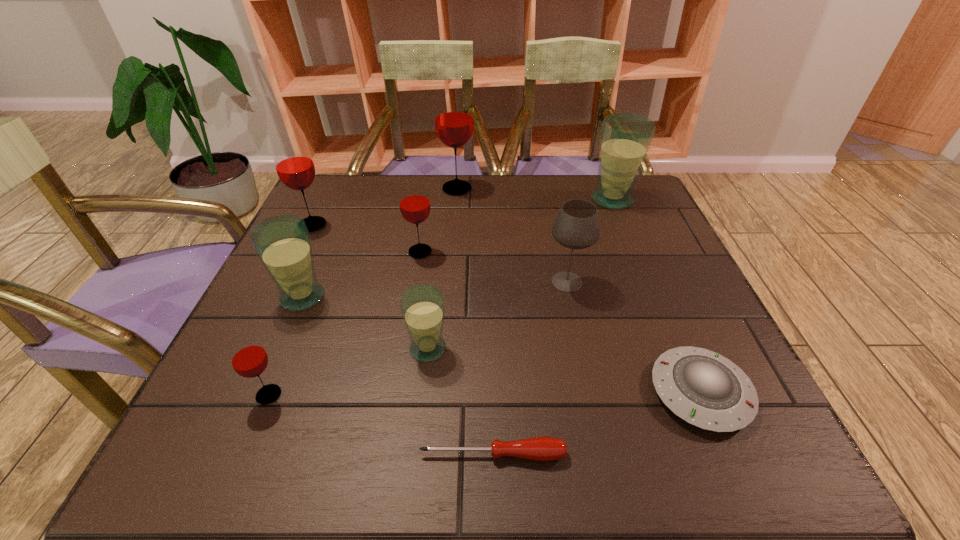
Locate an element on the screen. This screenshot has width=960, height=540. vacant area situated 0.050m on the front of the third farthest glass is located at coordinates (301, 247).

This screenshot has height=540, width=960. In order to click on vacant space located on the left of the farthest blue glass in this screenshot , I will do `click(493, 200)`.

The image size is (960, 540). I want to click on free spot located 0.060m on the front of the wineglass, so coord(574,318).

I want to click on free spot located on the back of the seventh nearest object, so click(424, 225).

The width and height of the screenshot is (960, 540). I want to click on free spot located 0.290m on the front of the leftmost blue glass, so click(239, 447).

This screenshot has height=540, width=960. I want to click on free space located on the front of the second nearest glass, so click(x=420, y=413).

Locate an element on the screen. The image size is (960, 540). vacant point located 0.320m on the right of the nearest red glass is located at coordinates (466, 395).

Locate an element on the screen. vacant space situated on the left of the second shortest object is located at coordinates (612, 393).

At what (x,y) coordinates should I click in order to perform the action: click on free space located 0.110m on the back of the red screwdriver. Please return your answer as a coordinate pair (x, y). The image size is (960, 540). Looking at the image, I should click on (492, 386).

Find the location of a particular element. saucer that is at the near edge is located at coordinates (705, 389).